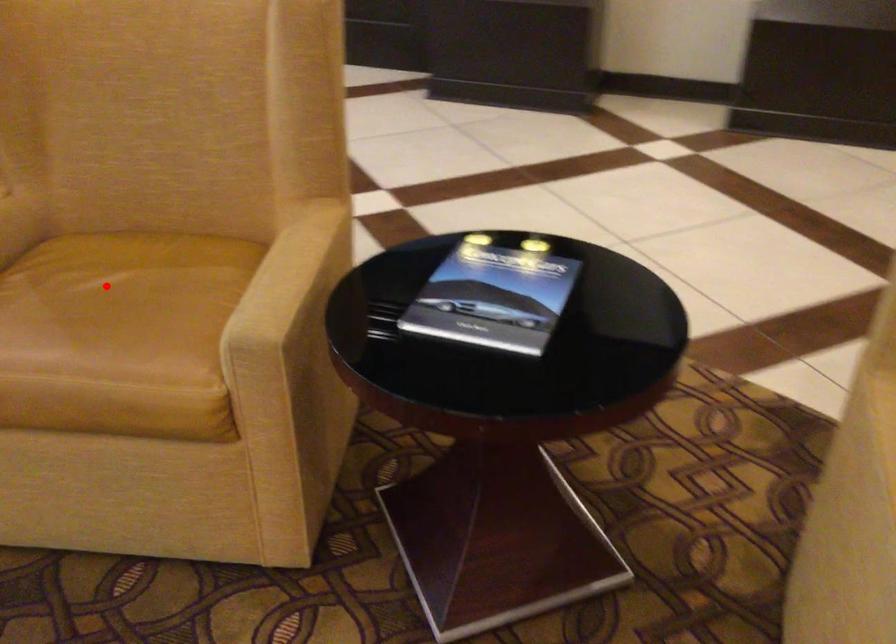
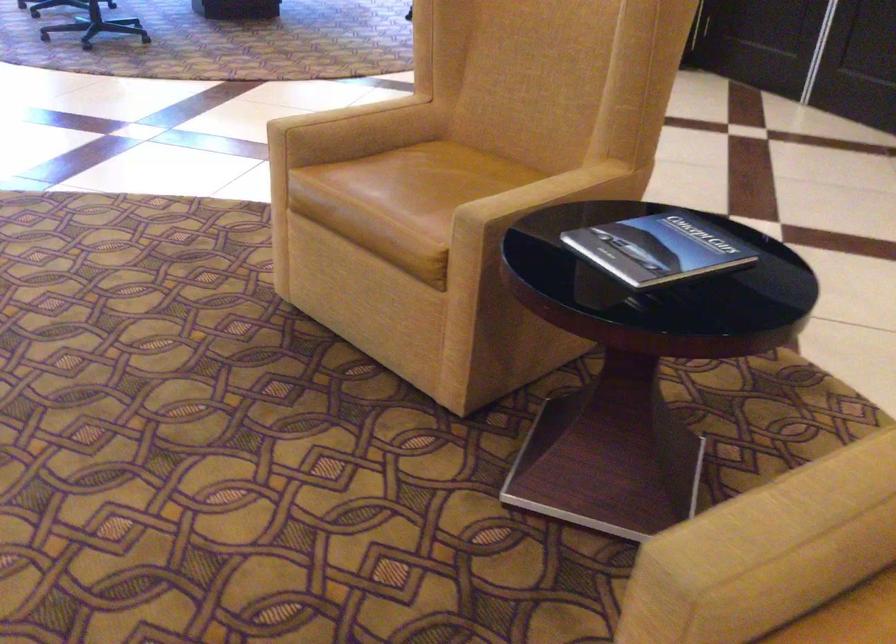
Where in the second image is the point corresponding to the highlighted location from the first image?

(440, 174)